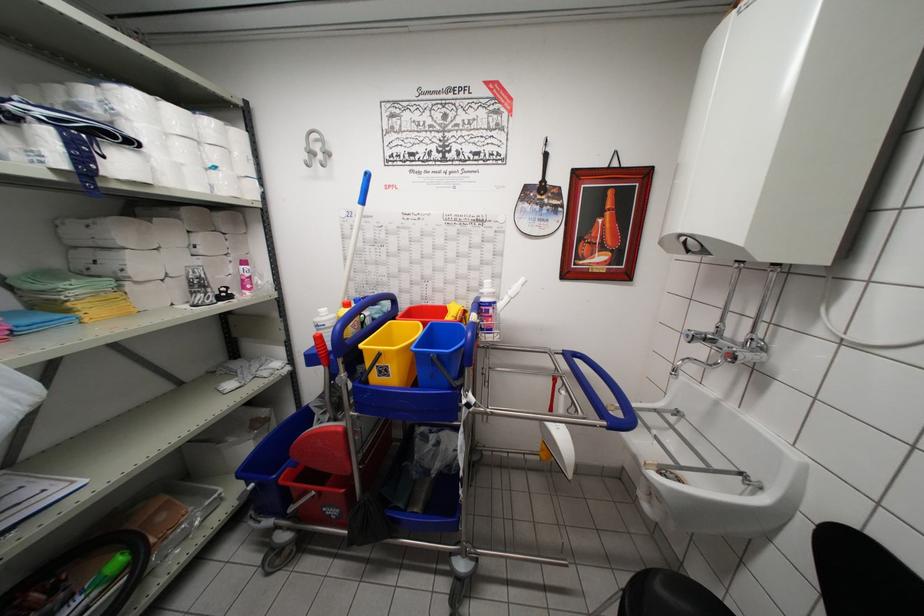
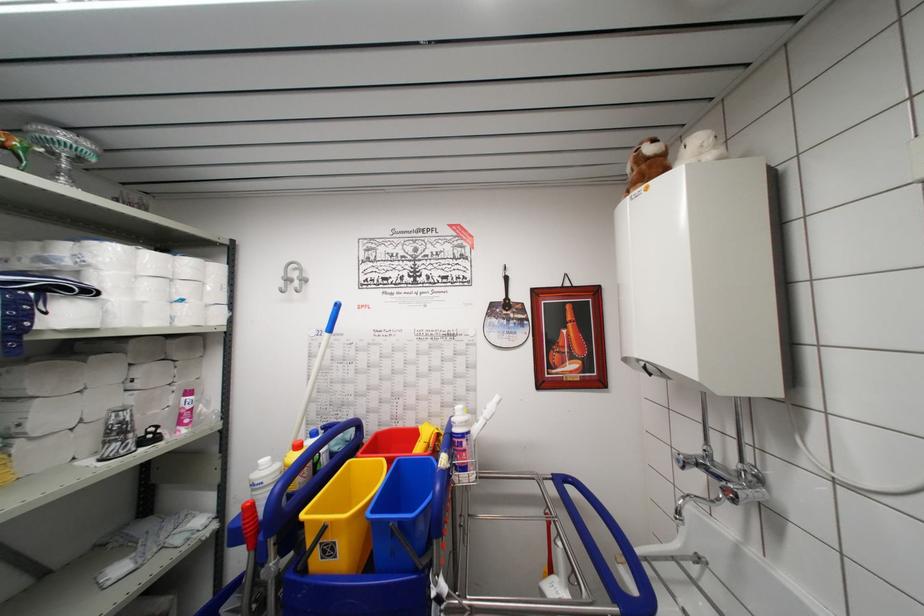
Find the pixel in the second image that matches (x=229, y=245) in the first image.

(178, 371)